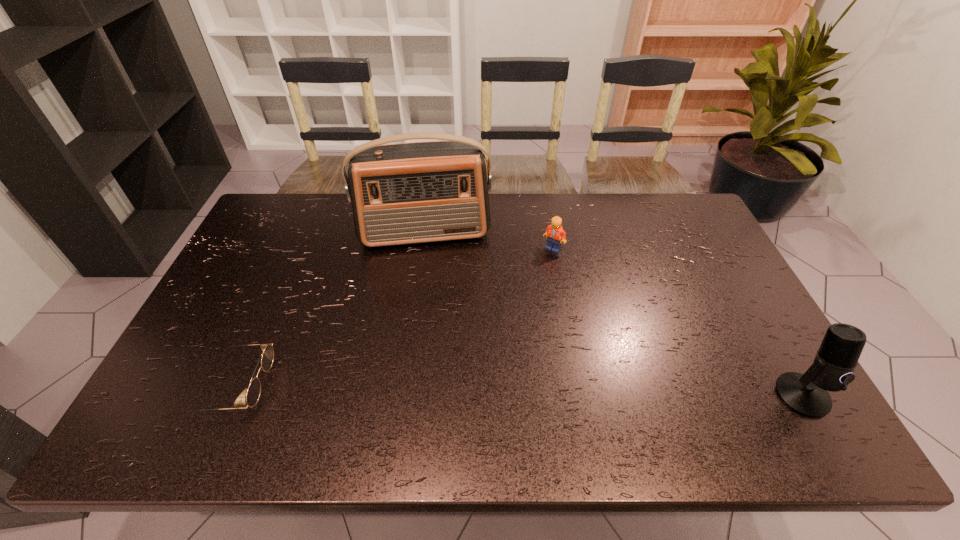
Find the location of a particular element. free spot on the desktop that is between the shortest object and the second tallest object and is positioned on the front-facing side of the third tallest object is located at coordinates (527, 392).

At what (x,y) coordinates should I click in order to perform the action: click on vacant spot on the desktop that is between the leftmost object and the microphone and is positioned on the front-facing side of the radio receiver. Please return your answer as a coordinate pair (x, y). Looking at the image, I should click on [x=436, y=390].